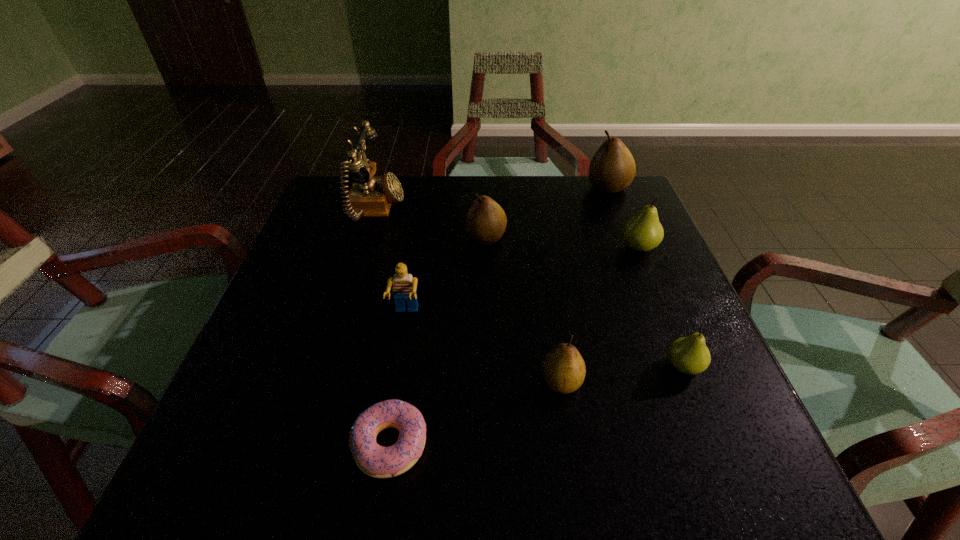
Identify the location of the tallest object. Image resolution: width=960 pixels, height=540 pixels. (369, 196).

Locate an element on the screen. the leftmost object is located at coordinates (369, 196).

This screenshot has height=540, width=960. What are the coordinates of `the rightmost brown pear` in the screenshot? It's located at (612, 168).

I want to click on the biggest brown pear, so click(x=612, y=168).

Image resolution: width=960 pixels, height=540 pixels. Find the location of `the second nearest brown pear`. the second nearest brown pear is located at coordinates (486, 221).

Identify the location of the leftmost pear. (486, 221).

I want to click on the bigger green pear, so click(x=643, y=232).

This screenshot has height=540, width=960. I want to click on blue Lego, so click(x=404, y=288).

Where is `Lego`? Lego is located at coordinates (404, 288).

Where is `the nearer green pear`? The image size is (960, 540). the nearer green pear is located at coordinates (690, 355).